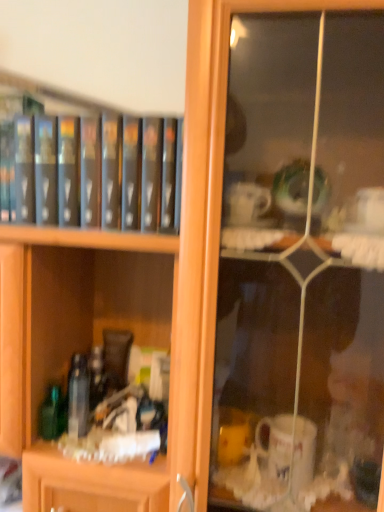
Question: Does black matte book at upper left appear on the left side of green glass bottle at lower left, which is the 1th bottle in left-to-right order?

Choices:
 (A) yes
 (B) no

Answer: (B)

Question: Is there a large distance between black matte book at upper left and green glass bottle at lower left, which is the 1th bottle in left-to-right order?

Choices:
 (A) no
 (B) yes

Answer: (A)

Question: Is black matte book at upper left outside of green glass bottle at lower left, which appears as the second bottle when viewed from the right?

Choices:
 (A) yes
 (B) no

Answer: (A)

Question: Can you confirm if black matte book at upper left is positioned to the right of green glass bottle at lower left, which is the 1th bottle in left-to-right order?

Choices:
 (A) no
 (B) yes

Answer: (B)

Question: From the image's perspective, is black matte book at upper left below green glass bottle at lower left, which is the 1th bottle in left-to-right order?

Choices:
 (A) no
 (B) yes

Answer: (A)

Question: Could you tell me if black matte book at upper left is facing green glass bottle at lower left, which is the 1th bottle in left-to-right order?

Choices:
 (A) yes
 (B) no

Answer: (B)

Question: Could you tell me if clear glass bottle at center, arranged as the second bottle when viewed from the left, is facing black matte book at upper left?

Choices:
 (A) no
 (B) yes

Answer: (A)

Question: Is clear glass bottle at center, arranged as the second bottle when viewed from the left, to the right of black matte book at upper left from the viewer's perspective?

Choices:
 (A) no
 (B) yes

Answer: (B)

Question: Is clear glass bottle at center, arranged as the second bottle when viewed from the left, taller than black matte book at upper left?

Choices:
 (A) no
 (B) yes

Answer: (A)

Question: Is the position of clear glass bottle at center, the first bottle from the right, more distant than that of black matte book at upper left?

Choices:
 (A) no
 (B) yes

Answer: (B)

Question: Are clear glass bottle at center, arranged as the second bottle when viewed from the left, and black matte book at upper left far apart?

Choices:
 (A) yes
 (B) no

Answer: (B)

Question: From a real-world perspective, is clear glass bottle at center, the first bottle from the right, located beneath black matte book at upper left?

Choices:
 (A) no
 (B) yes

Answer: (B)

Question: Can you confirm if green glass bottle at lower left, which is the 1th bottle in left-to-right order, is bigger than clear glass bottle at center, arranged as the second bottle when viewed from the left?

Choices:
 (A) yes
 (B) no

Answer: (B)